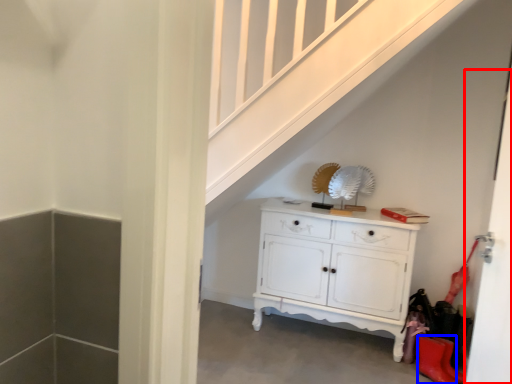
Question: Among these objects, which one is nearest to the camera, door (highlighted by a red box) or shoe (highlighted by a blue box)?

Choices:
 (A) door
 (B) shoe

Answer: (A)